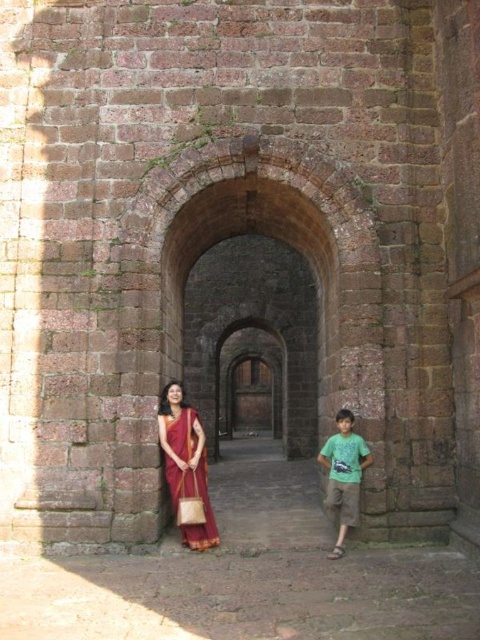
Image resolution: width=480 pixels, height=640 pixels. What do you see at coordinates (186, 464) in the screenshot? I see `maroon silk saree at center` at bounding box center [186, 464].

Where is `maroon silk saree at center`? The height and width of the screenshot is (640, 480). maroon silk saree at center is located at coordinates (186, 464).

You are a GUI agent. You are given a task and a screenshot of the screen. Output one action in this format:
    pyautogui.click(x=<x>, y=<y>)
    Task: Click on the maroon silk saree at center
    The height and width of the screenshot is (640, 480).
    Given the screenshot: What is the action you would take?
    pyautogui.click(x=186, y=464)